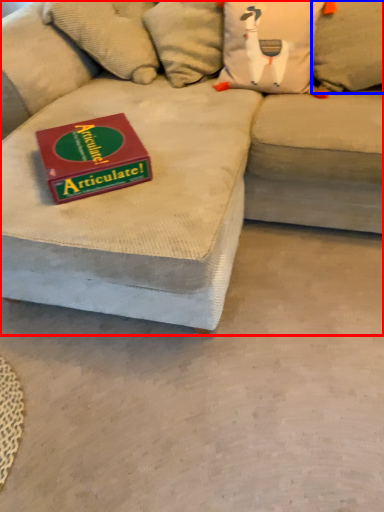
Question: Which object is closer to the camera taking this photo, studio couch (highlighted by a red box) or pillow (highlighted by a blue box)?

Choices:
 (A) studio couch
 (B) pillow

Answer: (A)